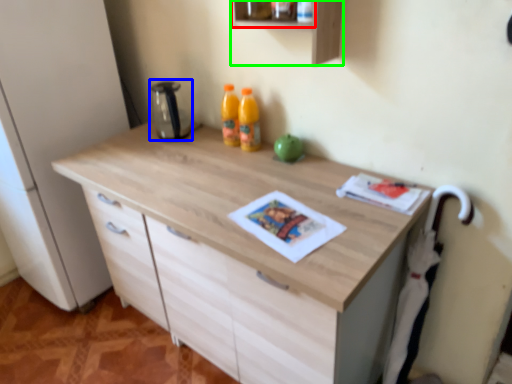
Question: Which is farther away from shelf (highlighted by a red box)? appliance (highlighted by a blue box) or shelf (highlighted by a green box)?

Choices:
 (A) appliance
 (B) shelf

Answer: (A)